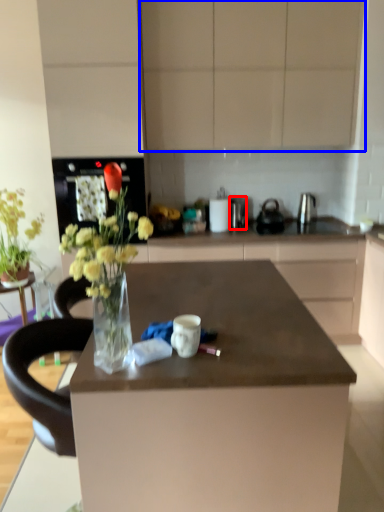
Question: Which object is further to the camera taking this photo, appliance (highlighted by a red box) or cabinetry (highlighted by a blue box)?

Choices:
 (A) appliance
 (B) cabinetry

Answer: (A)